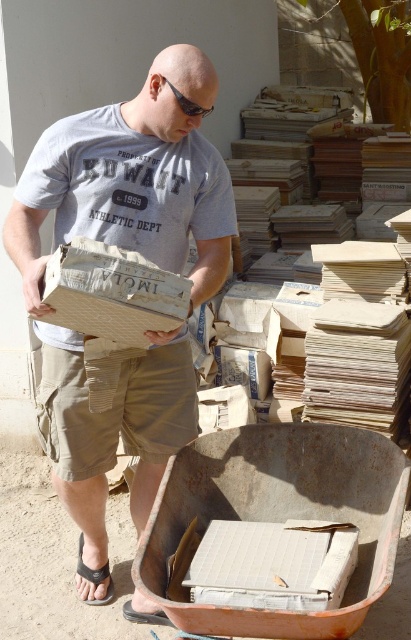
You are a delivery person who needs to place a new box between the matte cardboard box at center and the white corrugated cardboard box at lower center. Can you fit it there?

The distance between the matte cardboard box at center and the white corrugated cardboard box at lower center is 33.69 inches. Since the new box requires at least 30 inches of space, it can be placed there.

Looking at the man in the image, which item is positioned to the right of the other between the khaki cotton shorts at center and the black fabric sandal at lower left?

The khaki cotton shorts at center are to the right of the black fabric sandal at lower left.

Consider the image. Based on the scene described, which object is closer to the viewer between the white corrugated cardboard box at lower center and the black fabric sandal at lower left?

The white corrugated cardboard box at lower center is closer to the viewer because it is in front of the black fabric sandal at lower left.